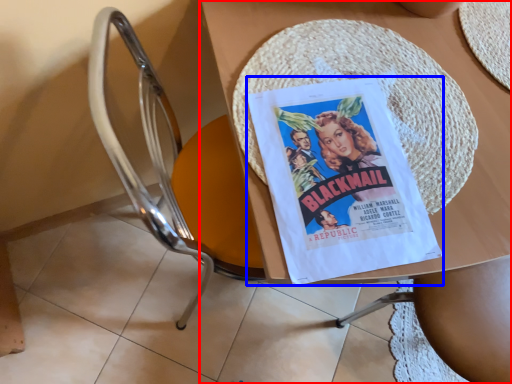
Question: Which object is further to the camera taking this photo, table (highlighted by a red box) or comic book (highlighted by a blue box)?

Choices:
 (A) table
 (B) comic book

Answer: (B)